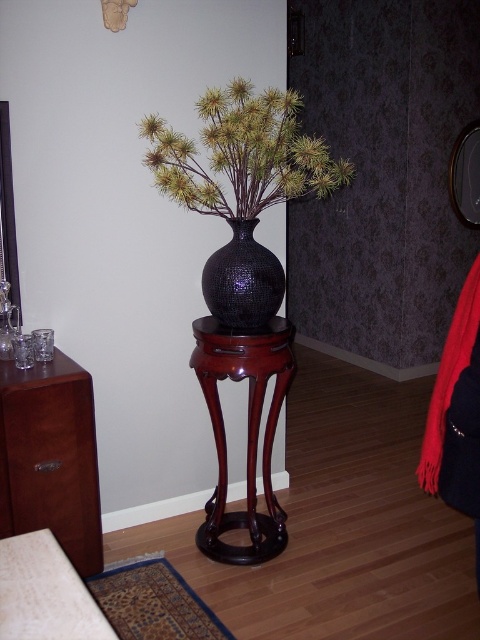
You are standing in the room and want to place a small decorative item on the wooden table at lower left. What are the coordinates where you should place it?

The wooden table at lower left is located at coordinates point (x=45, y=593), so you should place the item there.

You are standing in the room and want to place a small decorative item on the closest surface between the mahogany wood dresser at left and the black textured vase at center. Which surface should you choose?

The mahogany wood dresser at left is closer to the viewer than the black textured vase at center, so you should place the item on the mahogany wood dresser at left.